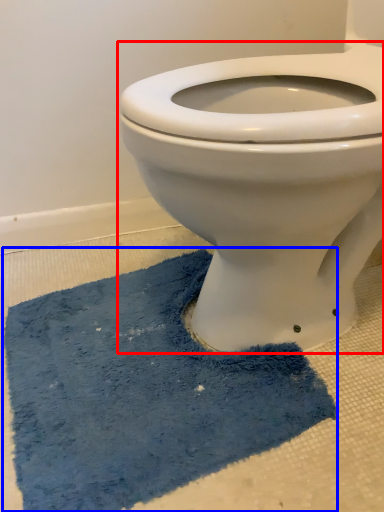
Question: Which object appears farthest to the camera in this image, toilet (highlighted by a red box) or bath mat (highlighted by a blue box)?

Choices:
 (A) toilet
 (B) bath mat

Answer: (B)